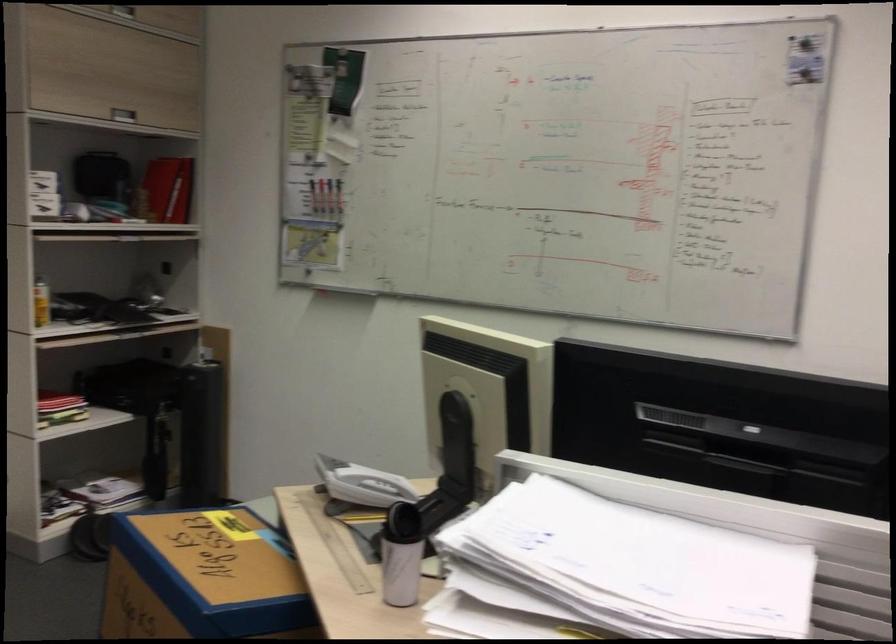
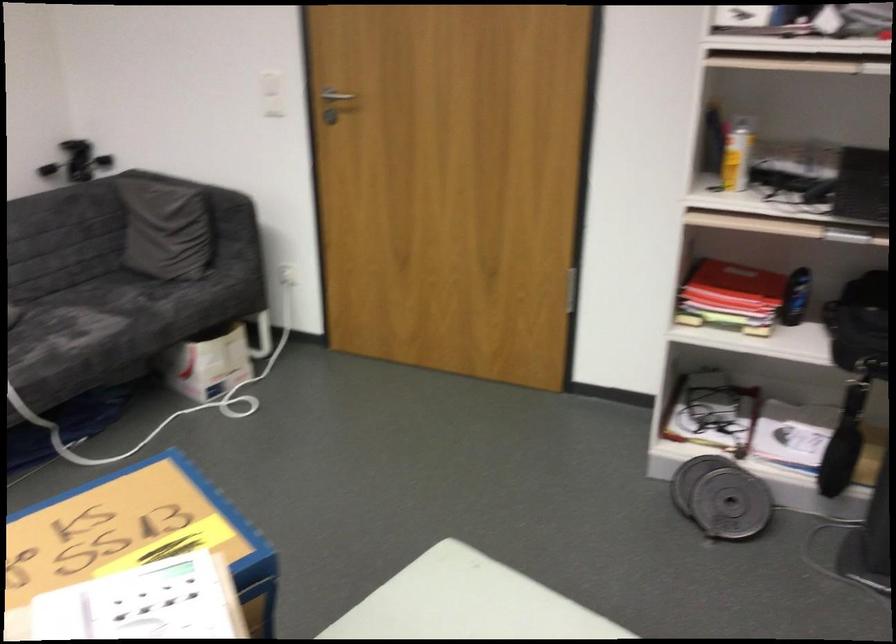
Where in the second image is the point corresponding to the point at 184,536 from the first image?

(139, 535)